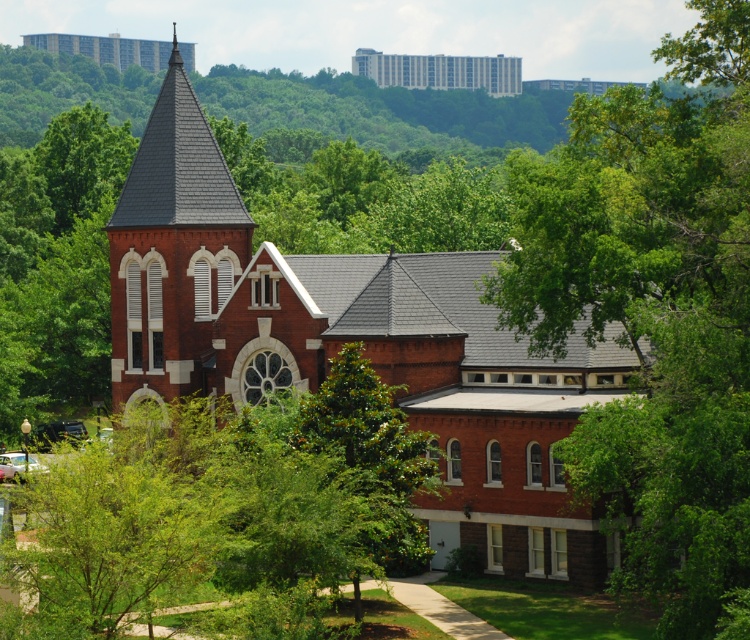
Who is more distant from viewer, (540, 317) or (372, 67)?

The point (372, 67) is more distant.

Is green leafy tree at center to the left of matte brick church at upper center from the viewer's perspective?

No, green leafy tree at center is not to the left of matte brick church at upper center.

This screenshot has width=750, height=640. I want to click on green leafy tree at center, so click(x=654, y=316).

Who is lower down, brick church at center or matte brick church at upper center?

Positioned lower is brick church at center.

Who is more forward, (514,490) or (519,65)?

Point (514,490)

This screenshot has height=640, width=750. In order to click on brick church at center in this screenshot , I will do `click(351, 340)`.

Where is `brick church at center`? brick church at center is located at coordinates (351, 340).

Can you confirm if green leafy tree at center is thinner than brick church at upper center?

Indeed, green leafy tree at center has a lesser width compared to brick church at upper center.

Which of these two, green leafy tree at center or brick church at upper center, stands taller?

Standing taller between the two is green leafy tree at center.

Is point (668, 193) more distant than point (135, 48)?

No, it is in front of (135, 48).

Where is `green leafy tree at center`? green leafy tree at center is located at coordinates (654, 316).